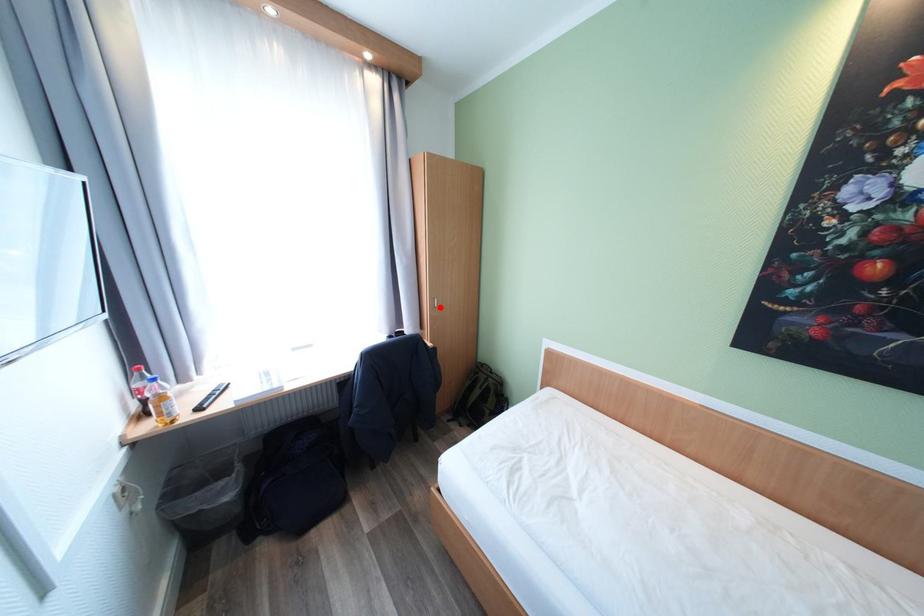
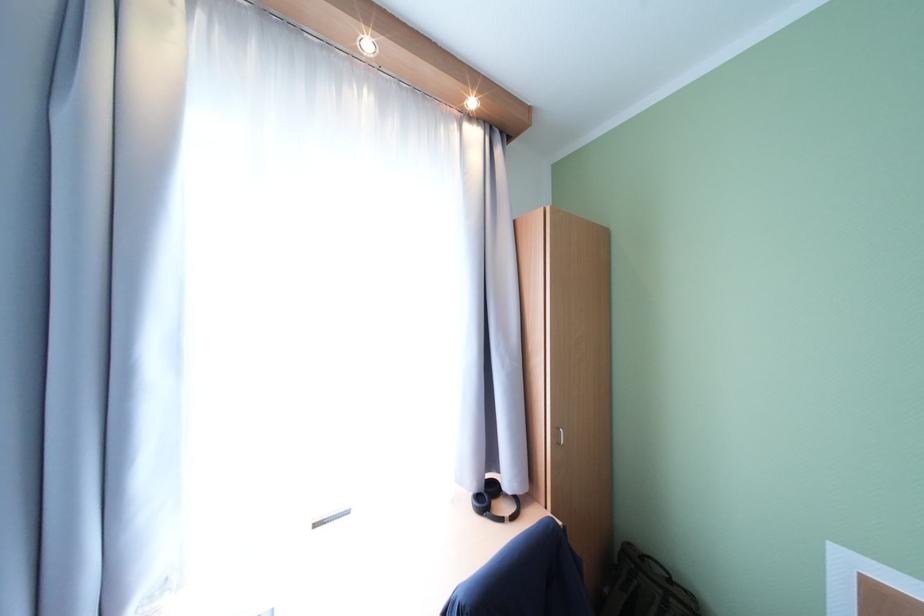
Locate, in the second image, the point that corresponds to the highlighted location in the first image.

(563, 444)